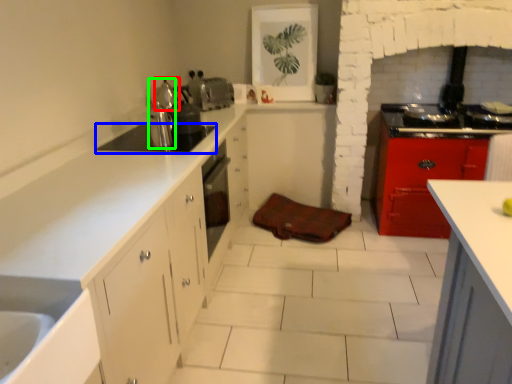
Question: Estimate the real-world distances between objects in this image. Which object is closer to tea pot (highlighted by a red box), appliance (highlighted by a blue box) or kitchen appliance (highlighted by a green box)?

Choices:
 (A) appliance
 (B) kitchen appliance

Answer: (B)